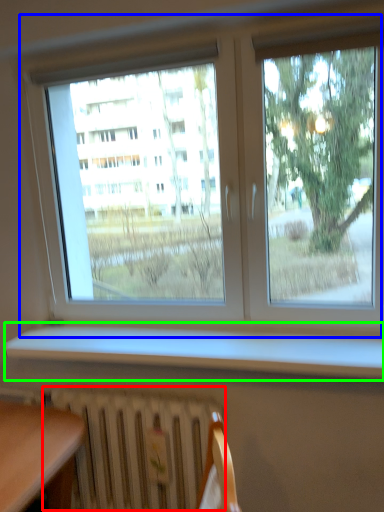
Question: Estimate the real-world distances between objects in this image. Which object is farther from radiator (highlighted by a red box), window (highlighted by a blue box) or window sill (highlighted by a green box)?

Choices:
 (A) window
 (B) window sill

Answer: (A)